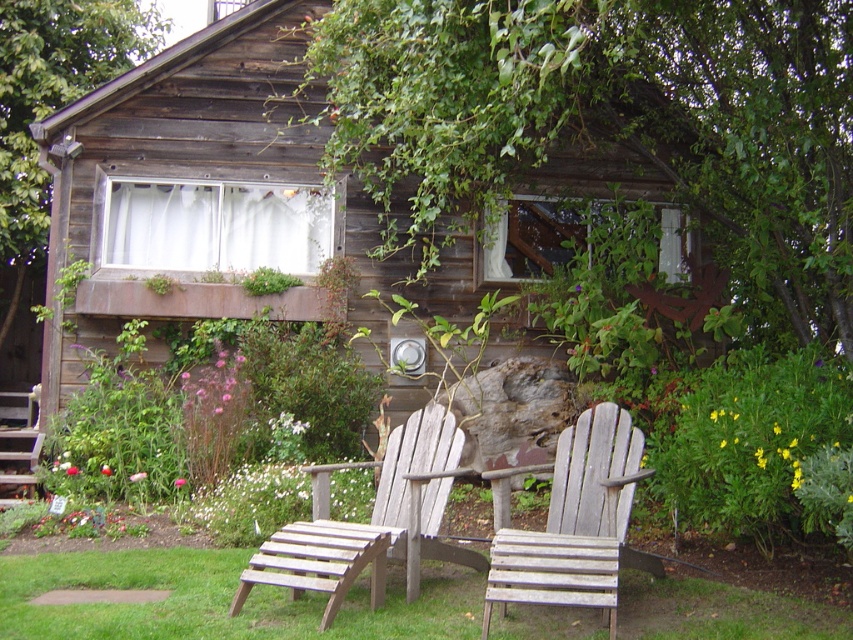
Is gray wooden chair at center bigger than wooden slats chair at center?

Actually, gray wooden chair at center might be smaller than wooden slats chair at center.

This screenshot has width=853, height=640. I want to click on gray wooden chair at center, so click(x=577, y=524).

The width and height of the screenshot is (853, 640). In order to click on gray wooden chair at center in this screenshot , I will do `click(577, 524)`.